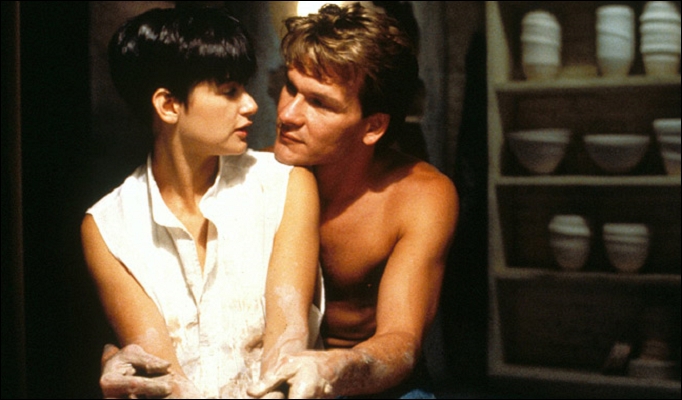
The height and width of the screenshot is (400, 682). I want to click on shelf, so click(x=539, y=374), click(x=520, y=276), click(x=526, y=183), click(x=517, y=90).